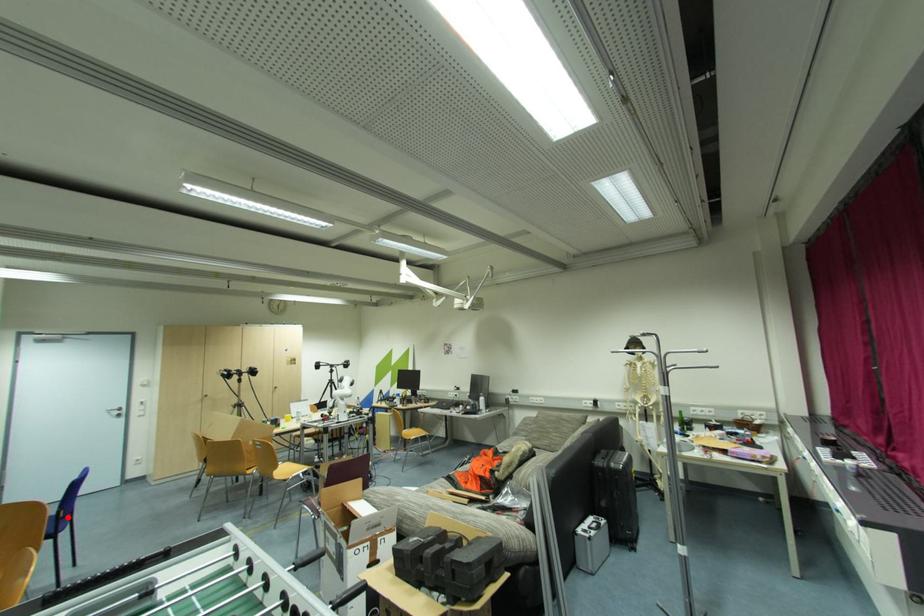
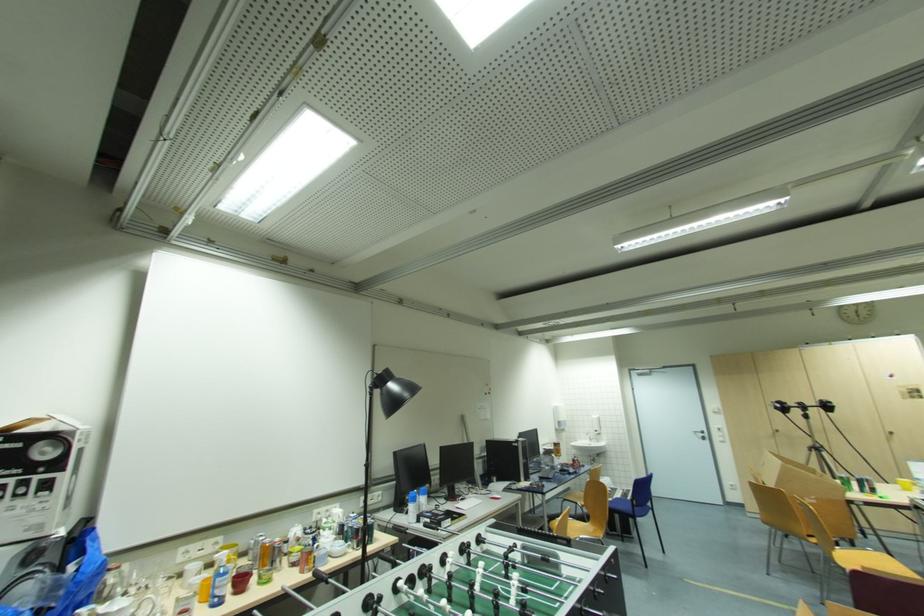
Locate, in the second image, the point that corresponds to the highlighted location in the first image.

(639, 506)